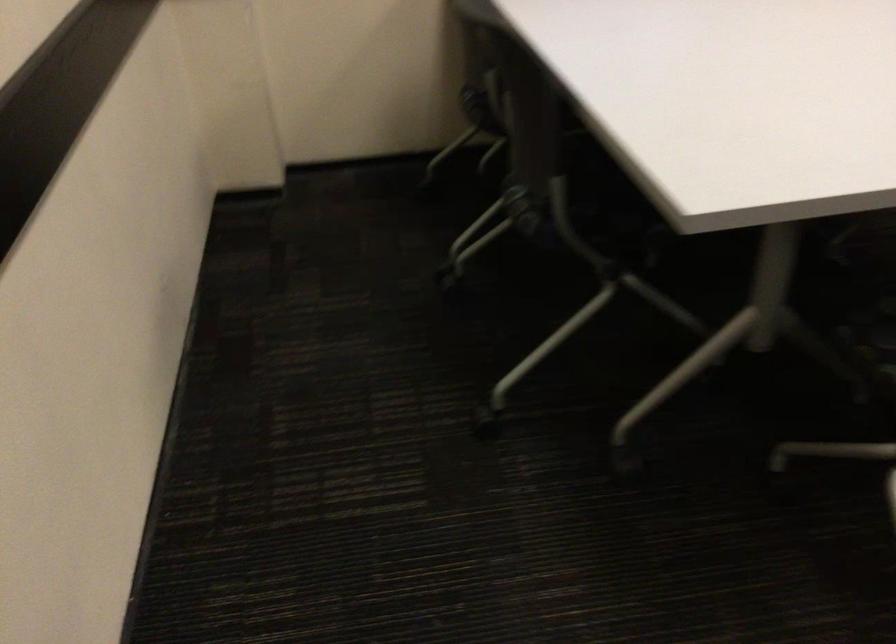
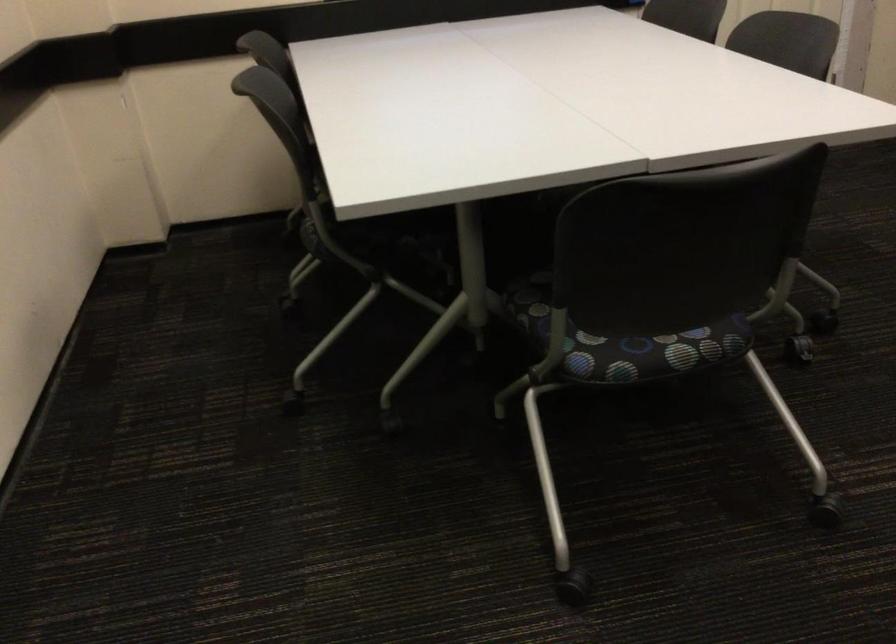
Question: The images are taken continuously from a first-person perspective. In which direction is your viewpoint rotating?

Choices:
 (A) Left
 (B) Right
 (C) Up
 (D) Down

Answer: (C)